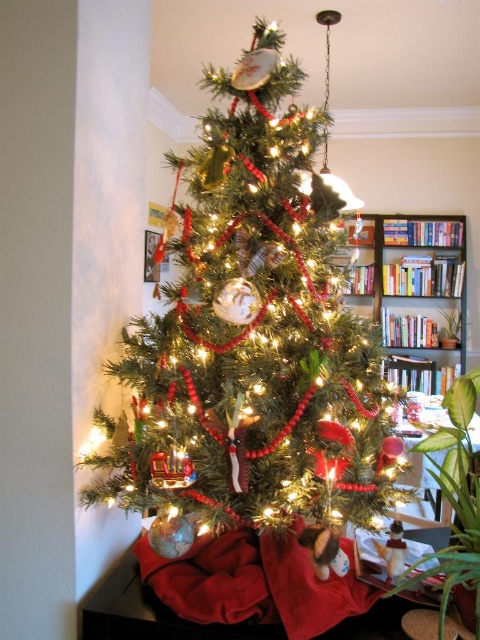
Question: Does green matte christmas tree at center appear over wooden bookshelf at center?

Choices:
 (A) yes
 (B) no

Answer: (B)

Question: Which object appears farthest from the camera in this image?

Choices:
 (A) wooden bookshelf at center
 (B) green matte christmas tree at center

Answer: (A)

Question: Can you confirm if green matte christmas tree at center is positioned to the left of wooden bookshelf at center?

Choices:
 (A) no
 (B) yes

Answer: (B)

Question: Which point is closer to the camera taking this photo?

Choices:
 (A) (136, 344)
 (B) (453, 236)

Answer: (A)

Question: Is green matte christmas tree at center above wooden bookshelf at center?

Choices:
 (A) no
 (B) yes

Answer: (A)